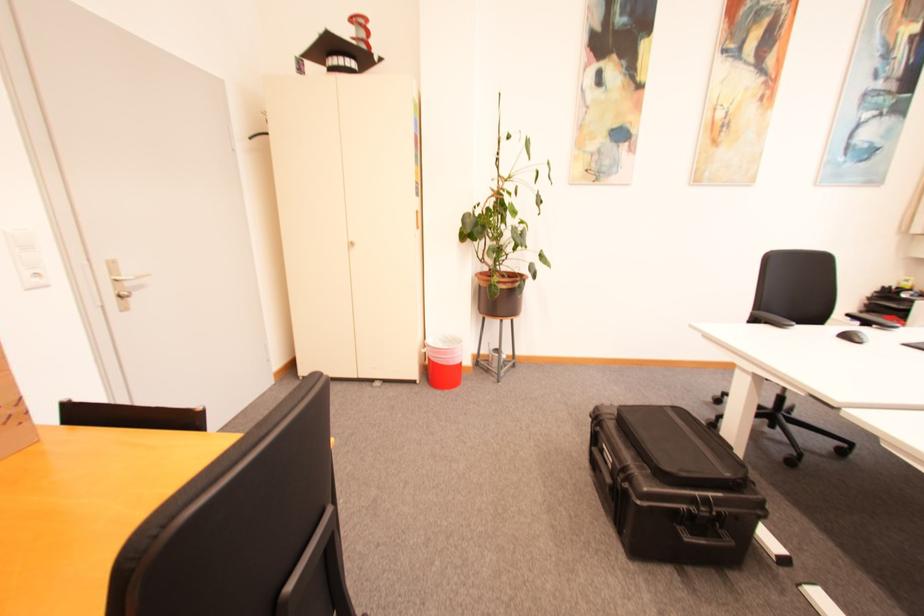
Identify the location of chair armrest. The height and width of the screenshot is (616, 924). (771, 318).